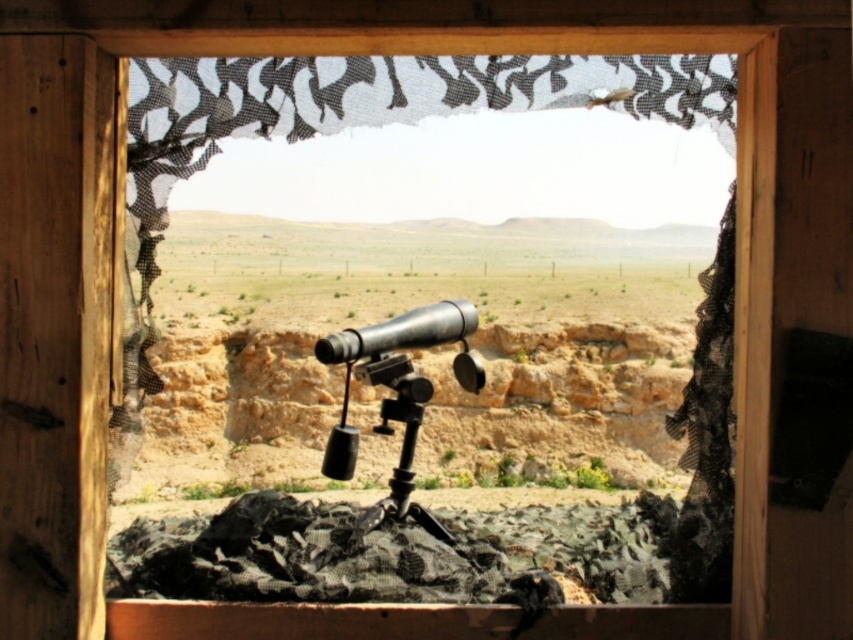
You are a soldier in a desert outpost. You need to observe an approaching vehicle through the window. The black mesh curtain at right and the brushed metal telescope at center are in your line of sight. Which object is closer to the ground?

The black mesh curtain at right is below the brushed metal telescope at center, so it is closer to the ground.

You are looking through the window and see two points in the distance. Which point is closer to you, the point at coordinates (699, 376) or the point at coordinates (469, 387)?

The point at coordinates (699, 376) is closer to the viewer than the point at coordinates (469, 387).

Consider the image. You are a field researcher who needs to observe the landscape through the window. The black mesh curtain at right and the brushed metal telescope at center are both in your line of sight. Which object would block more of your view horizontally?

The black mesh curtain at right has a larger width than the brushed metal telescope at center, so it would block more of your horizontal view.